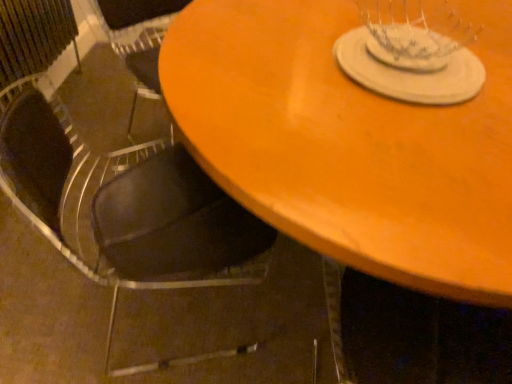
You are a GUI agent. You are given a task and a screenshot of the screen. Output one action in this format:
    pyautogui.click(x=<x>, y=<y>)
    Task: Click on the vacant area situated to the left side of white matte glass plate at upper center
    The width and height of the screenshot is (512, 384).
    Given the screenshot: What is the action you would take?
    pyautogui.click(x=265, y=51)